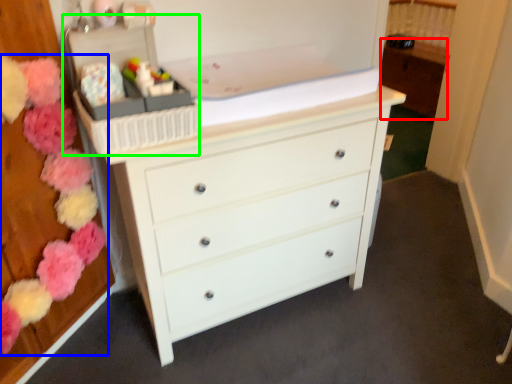
Question: Estimate the real-world distances between objects in this image. Which object is closer to cabinetry (highlighted by a red box), flower (highlighted by a blue box) or storage box (highlighted by a green box)?

Choices:
 (A) flower
 (B) storage box

Answer: (B)